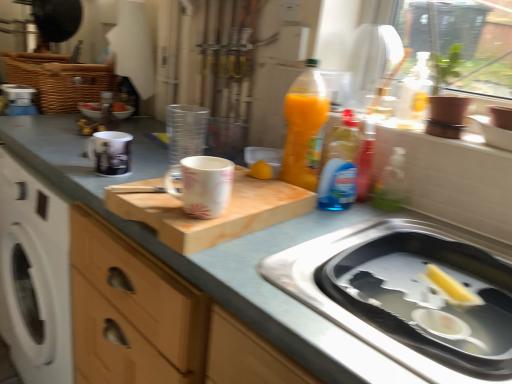
Question: Should I look upward or downward to see pink floral ceramic mug at center, which ranks as the 1th mug in front-to-back order?

Choices:
 (A) up
 (B) down

Answer: (A)

Question: Does stainless steel sink at lower right turn towards matte white mug at upper left, which ranks as the first mug in back-to-front order?

Choices:
 (A) no
 (B) yes

Answer: (A)

Question: Can you confirm if stainless steel sink at lower right is smaller than matte white mug at upper left, which ranks as the first mug in back-to-front order?

Choices:
 (A) no
 (B) yes

Answer: (A)

Question: From the image's perspective, is stainless steel sink at lower right below matte white mug at upper left, which ranks as the first mug in back-to-front order?

Choices:
 (A) no
 (B) yes

Answer: (B)

Question: Does stainless steel sink at lower right have a greater height compared to matte white mug at upper left, which ranks as the first mug in back-to-front order?

Choices:
 (A) no
 (B) yes

Answer: (B)

Question: Considering the relative sizes of stainless steel sink at lower right and matte white mug at upper left, which is the 2th mug from front to back, in the image provided, is stainless steel sink at lower right shorter than matte white mug at upper left, which is the 2th mug from front to back,?

Choices:
 (A) no
 (B) yes

Answer: (A)

Question: Is stainless steel sink at lower right not close to matte white mug at upper left, which ranks as the first mug in back-to-front order?

Choices:
 (A) yes
 (B) no

Answer: (B)

Question: Considering the relative sizes of yellow rubber duck at sink right and translucent plastic bottle at upper center, the 2th bottle in the left-to-right sequence, in the image provided, is yellow rubber duck at sink right taller than translucent plastic bottle at upper center, the 2th bottle in the left-to-right sequence,?

Choices:
 (A) no
 (B) yes

Answer: (A)

Question: Considering the relative positions of yellow rubber duck at sink right and translucent plastic bottle at upper center, which is counted as the first bottle, starting from the bottom, in the image provided, is yellow rubber duck at sink right in front of translucent plastic bottle at upper center, which is counted as the first bottle, starting from the bottom,?

Choices:
 (A) no
 (B) yes

Answer: (B)

Question: Is yellow rubber duck at sink right further to camera compared to translucent plastic bottle at upper center, the 2th bottle in the left-to-right sequence?

Choices:
 (A) no
 (B) yes

Answer: (A)

Question: From a real-world perspective, is yellow rubber duck at sink right below translucent plastic bottle at upper center, which is counted as the first bottle, starting from the bottom?

Choices:
 (A) no
 (B) yes

Answer: (B)

Question: Does yellow rubber duck at sink right have a lesser height compared to translucent plastic bottle at upper center, marked as the 2th bottle in a back-to-front arrangement?

Choices:
 (A) yes
 (B) no

Answer: (A)

Question: Is yellow rubber duck at sink right not within translucent plastic bottle at upper center, marked as the 2th bottle in a back-to-front arrangement?

Choices:
 (A) no
 (B) yes

Answer: (B)

Question: Is metallic silver bottle at upper center, which appears as the 1th bottle when viewed from the back, in contact with wooden cutting board at center?

Choices:
 (A) no
 (B) yes

Answer: (A)